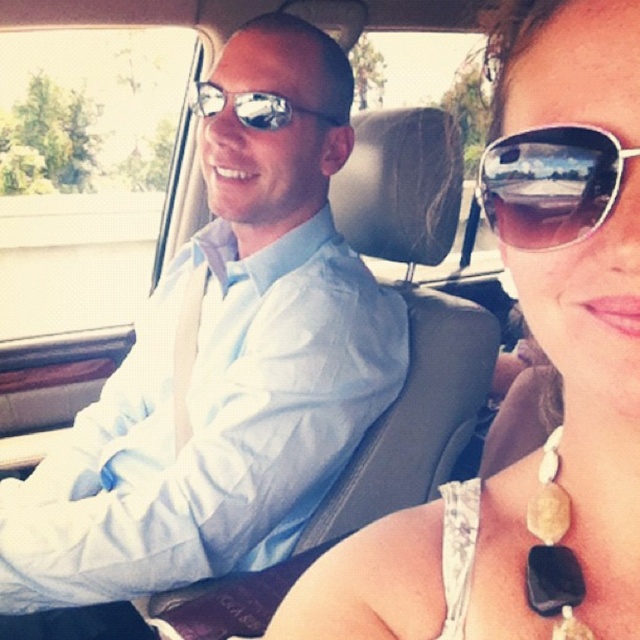
Question: Which point is farther from the camera taking this photo?

Choices:
 (A) (624, 269)
 (B) (483, 202)
 (C) (563, 620)
 (D) (177, 422)

Answer: (D)

Question: Is matte white tank top at center smaller than matte reflective sunglasses at center?

Choices:
 (A) yes
 (B) no

Answer: (B)

Question: Observing the image, what is the correct spatial positioning of matte white tank top at center in reference to sunglasses at right?

Choices:
 (A) above
 (B) below

Answer: (B)

Question: Which point is closer to the camera?

Choices:
 (A) (531, 579)
 (B) (243, 115)
 (C) (220, 232)

Answer: (A)

Question: Estimate the real-world distances between objects in this image. Which object is farther from the matte light blue shirt at center?

Choices:
 (A) matte white tank top at center
 (B) sunglasses at right

Answer: (B)

Question: Can you confirm if matte light blue shirt at center is thinner than black stone necklace at lower right?

Choices:
 (A) yes
 (B) no

Answer: (B)